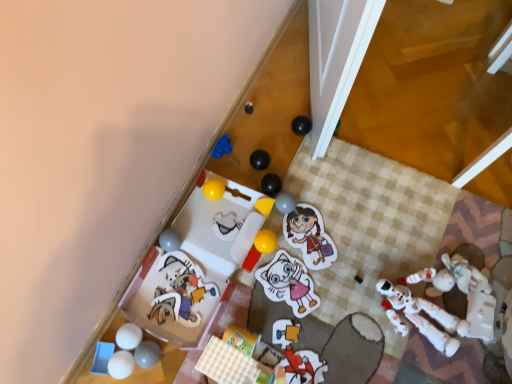
At what (x,y) coordinates should I click in order to perform the action: click on vacant space in front of white matte cat at center, placed as the fourteenth toy when sorted from left to right. Please return your answer as a coordinate pair (x, y). The image size is (512, 384). Looking at the image, I should click on (296, 345).